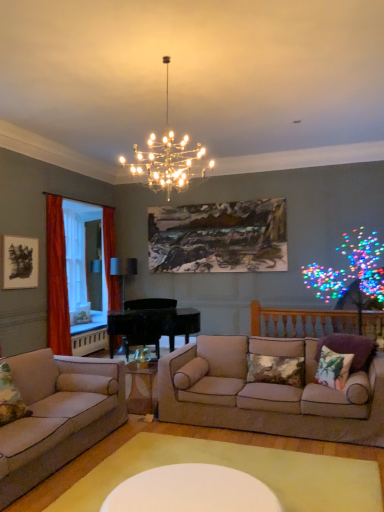
The height and width of the screenshot is (512, 384). What are the coordinates of `beige fabric couch at lower left, which ranks as the 1th studio couch in left-to-right order` in the screenshot? It's located at (58, 416).

Find the location of `velvet orange curtain at left, the 1th curtain positioned from the front`. velvet orange curtain at left, the 1th curtain positioned from the front is located at coordinates (57, 279).

The image size is (384, 512). What do you see at coordinates (276, 369) in the screenshot? I see `textured beige pillow at center, acting as the third pillow starting from the right` at bounding box center [276, 369].

Describe the element at coordinates (84, 263) in the screenshot. I see `clear glass window screen at left, the 2th window screen viewed from the front` at that location.

The height and width of the screenshot is (512, 384). I want to click on matte black lamp at center, the first lamp when ordered from back to front, so click(x=123, y=270).

From a real-world perspective, which is physically above, beige fabric couch at center, marked as the 2th studio couch in a left-to-right arrangement, or black matte picture frame at upper left, which ranks as the first picture frame in front-to-back order?

black matte picture frame at upper left, which ranks as the first picture frame in front-to-back order, is physically above.

Measure the distance from beige fabric couch at center, marked as the 2th studio couch in a left-to-right arrangement, to black matte picture frame at upper left, the second picture frame viewed from the right.

9.20 feet.

Based on the photo, which is in front, beige fabric couch at center, which ranks as the first studio couch in right-to-left order, or black matte picture frame at upper left, the second picture frame viewed from the right?

Positioned in front is beige fabric couch at center, which ranks as the first studio couch in right-to-left order.

From the picture: What's the angular difference between beige fabric couch at center, which ranks as the first studio couch in right-to-left order, and black matte picture frame at upper left, which is the second picture frame from back to front,'s facing directions?

beige fabric couch at center, which ranks as the first studio couch in right-to-left order, and black matte picture frame at upper left, which is the second picture frame from back to front, are facing 90.6 degrees away from each other.

Can you confirm if beige fabric couch at center, marked as the 2th studio couch in a left-to-right arrangement, is positioned to the left of clear glass window screen at left, arranged as the 1th window screen when viewed from the back?

No.

Measure the distance from beige fabric couch at center, marked as the 2th studio couch in a left-to-right arrangement, to clear glass window screen at left, arranged as the 1th window screen when viewed from the back.

A distance of 2.60 meters exists between beige fabric couch at center, marked as the 2th studio couch in a left-to-right arrangement, and clear glass window screen at left, arranged as the 1th window screen when viewed from the back.

From their relative heights in the image, would you say beige fabric couch at center, marked as the 2th studio couch in a left-to-right arrangement, is taller or shorter than clear glass window screen at left, the 2th window screen viewed from the front?

Considering their sizes, beige fabric couch at center, marked as the 2th studio couch in a left-to-right arrangement, has less height than clear glass window screen at left, the 2th window screen viewed from the front.

Is beige fabric couch at center, which ranks as the first studio couch in right-to-left order, facing away from clear glass window screen at left, arranged as the 1th window screen when viewed from the back?

No, beige fabric couch at center, which ranks as the first studio couch in right-to-left order, is not facing the opposite direction of clear glass window screen at left, arranged as the 1th window screen when viewed from the back.

From a real-world perspective, starting from the beige fabric couch at center, which ranks as the first studio couch in right-to-left order, which picture frame is the 2nd one vertically above it? Please provide its 2D coordinates.

[(218, 237)]

Consider the image. Who is shorter, oil painting at upper center, positioned as the 1th picture frame in back-to-front order, or beige fabric couch at center, marked as the 2th studio couch in a left-to-right arrangement?

beige fabric couch at center, marked as the 2th studio couch in a left-to-right arrangement, is shorter.

How much distance is there between oil painting at upper center, arranged as the 1th picture frame when viewed from the right, and beige fabric couch at center, marked as the 2th studio couch in a left-to-right arrangement?

oil painting at upper center, arranged as the 1th picture frame when viewed from the right, and beige fabric couch at center, marked as the 2th studio couch in a left-to-right arrangement, are 1.97 meters apart from each other.

Considering the relative positions of oil painting at upper center, arranged as the 1th picture frame when viewed from the right, and beige fabric couch at center, marked as the 2th studio couch in a left-to-right arrangement, in the image provided, is oil painting at upper center, arranged as the 1th picture frame when viewed from the right, in front of beige fabric couch at center, marked as the 2th studio couch in a left-to-right arrangement,?

No, it is not.

Locate an element on the screen. Image resolution: width=384 pixels, height=512 pixels. coffee table in front of the clear glass window screen at left, the 2th window screen viewed from the front is located at coordinates (141, 387).

Does clear glass window screen at left, the 2th window screen viewed from the front, have a smaller size compared to clear glass coffee table at center?

No.

Is clear glass window screen at left, arranged as the 1th window screen when viewed from the back, to the left of clear glass coffee table at center from the viewer's perspective?

Yes.

Consider the image. How distant is clear glass window screen at left, the 2th window screen viewed from the front, from clear glass coffee table at center?

They are 2.00 meters apart.

Based on the photo, what's the angular difference between clear glass coffee table at center and beige fabric couch at lower left, which appears as the 2th studio couch when viewed from the right,'s facing directions?

89.9 degrees separate the facing orientations of clear glass coffee table at center and beige fabric couch at lower left, which appears as the 2th studio couch when viewed from the right.

Is clear glass coffee table at center not near beige fabric couch at lower left, which ranks as the 1th studio couch in left-to-right order?

Actually, clear glass coffee table at center and beige fabric couch at lower left, which ranks as the 1th studio couch in left-to-right order, are a little close together.

Which object is closer to the camera, clear glass coffee table at center or beige fabric couch at lower left, which appears as the 2th studio couch when viewed from the right?

beige fabric couch at lower left, which appears as the 2th studio couch when viewed from the right, is more forward.

How much distance is there between clear glass coffee table at center and beige fabric couch at lower left, which ranks as the 1th studio couch in left-to-right order?

The distance of clear glass coffee table at center from beige fabric couch at lower left, which ranks as the 1th studio couch in left-to-right order, is 26.85 inches.

In terms of width, does purple floral cushion at right, the first pillow from the right, look wider or thinner when compared to black matte picture frame at upper left, the second picture frame viewed from the right?

In the image, purple floral cushion at right, the first pillow from the right, appears to be wider than black matte picture frame at upper left, the second picture frame viewed from the right.

Considering the relative positions of purple floral cushion at right, the third pillow viewed from the left, and black matte picture frame at upper left, the second picture frame viewed from the right, in the image provided, is purple floral cushion at right, the third pillow viewed from the left, in front of black matte picture frame at upper left, the second picture frame viewed from the right,?

Yes, the depth of purple floral cushion at right, the third pillow viewed from the left, is less than that of black matte picture frame at upper left, the second picture frame viewed from the right.

From the image's perspective, which one is positioned higher, purple floral cushion at right, the third pillow viewed from the left, or black matte picture frame at upper left, the 1th picture frame from the left?

From the image's view, black matte picture frame at upper left, the 1th picture frame from the left, is above.

Can you see metallic chandelier at upper center, the second lamp viewed from the left, touching beige fabric couch at lower left, which appears as the 2th studio couch when viewed from the right?

No.

Is metallic chandelier at upper center, acting as the first lamp starting from the top, outside of beige fabric couch at lower left, which appears as the 2th studio couch when viewed from the right?

Yes, metallic chandelier at upper center, acting as the first lamp starting from the top, is located beyond the bounds of beige fabric couch at lower left, which appears as the 2th studio couch when viewed from the right.

Can you confirm if metallic chandelier at upper center, acting as the first lamp starting from the top, is positioned to the left of beige fabric couch at lower left, which appears as the 2th studio couch when viewed from the right?

Incorrect, metallic chandelier at upper center, acting as the first lamp starting from the top, is not on the left side of beige fabric couch at lower left, which appears as the 2th studio couch when viewed from the right.

Find the location of a particular element. Image resolution: width=384 pixels, height=512 pixels. the 1st picture frame above the beige fabric couch at center, marked as the 2th studio couch in a left-to-right arrangement (from the image's perspective) is located at coordinates 20,262.

From the beige fabric couch at center, marked as the 2th studio couch in a left-to-right arrangement, count 2nd window screens backward and point to it. Please provide its 2D coordinates.

[(84, 263)]

From the image, which object appears to be nearer to black matte picture frame at upper left, the 1th picture frame from the left, translucent fabric curtain at left, positioned as the 2th window screen in back-to-front order, or oil painting at upper center, positioned as the 1th picture frame in back-to-front order?

translucent fabric curtain at left, positioned as the 2th window screen in back-to-front order.

Consider the image. When comparing their distances from white glossy table at center, does purple floral cushion at right, the first pillow from the right, or floral fabric pillow at right, placed as the second pillow when sorted from left to right, seem further?

The object further to white glossy table at center is purple floral cushion at right, the first pillow from the right.

Based on their spatial positions, is orange velvet curtain at left, which is the second curtain from front to back, or velvet orange curtain at left, the 2th curtain when ordered from right to left, further from beige fabric couch at lower left, which appears as the 2th studio couch when viewed from the right?

orange velvet curtain at left, which is the second curtain from front to back.

Estimate the real-world distances between objects in this image. Which object is further from velvet orange curtain at left, the 2th curtain when ordered from right to left, matte black lamp at center, the first lamp when ordered from back to front, or black matte picture frame at upper left, the second picture frame viewed from the right?

matte black lamp at center, the first lamp when ordered from back to front, is further to velvet orange curtain at left, the 2th curtain when ordered from right to left.

Based on the photo, considering their positions, is black matte picture frame at upper left, which ranks as the first picture frame in front-to-back order, positioned further to textured beige pillow at center, acting as the third pillow starting from the right, than clear glass window screen at left, the 2th window screen viewed from the front?

black matte picture frame at upper left, which ranks as the first picture frame in front-to-back order, is further to textured beige pillow at center, acting as the third pillow starting from the right.

Looking at the image, which one is located further to clear glass coffee table at center, textured beige pillow at center, acting as the third pillow starting from the right, or beige fabric couch at center, which ranks as the first studio couch in right-to-left order?

The object further to clear glass coffee table at center is textured beige pillow at center, acting as the third pillow starting from the right.

Based on the photo, when comparing their distances from velvet orange curtain at left, the 1th curtain positioned from the front, does white glossy table at center or matte black lamp at center, the first lamp when ordered from back to front, seem closer?

matte black lamp at center, the first lamp when ordered from back to front, is positioned closer to the anchor velvet orange curtain at left, the 1th curtain positioned from the front.

When comparing their distances from black matte picture frame at upper left, which is the second picture frame from back to front, does beige fabric couch at center, marked as the 2th studio couch in a left-to-right arrangement, or beige fabric couch at lower left, which ranks as the 1th studio couch in left-to-right order, seem closer?

Among the two, beige fabric couch at lower left, which ranks as the 1th studio couch in left-to-right order, is located nearer to black matte picture frame at upper left, which is the second picture frame from back to front.

I want to click on pillow positioned between purple floral cushion at right, the first pillow from the right, and clear glass window screen at left, arranged as the 1th window screen when viewed from the back, from near to far, so click(x=276, y=369).

This screenshot has width=384, height=512. I want to click on studio couch between clear glass coffee table at center and floral fabric pillow at right, the second pillow from the right, so click(268, 393).

This screenshot has height=512, width=384. Identify the location of lamp positioned between beige fabric couch at lower left, which appears as the 2th studio couch when viewed from the right, and black matte picture frame at upper left, which ranks as the first picture frame in front-to-back order, from near to far. (168, 158).

In order to click on curtain located between clear glass window screen at left, arranged as the 1th window screen when viewed from the back, and oil painting at upper center, positioned as the 1th picture frame in back-to-front order, in the left-right direction in this screenshot , I will do `click(110, 260)`.